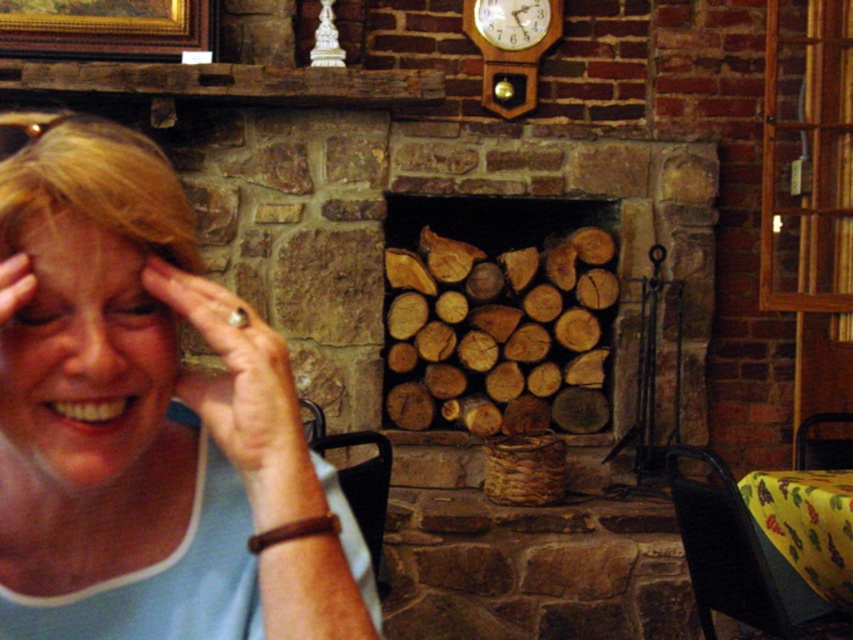
Question: Which object is closer to the camera taking this photo?

Choices:
 (A) yellow fabric tablecloth at lower right
 (B) wooden logs at center

Answer: (A)

Question: Does matte blue shirt at center have a lesser width compared to gold-framed painting at upper left?

Choices:
 (A) yes
 (B) no

Answer: (A)

Question: Which of the following is the farthest from the observer?

Choices:
 (A) (102, 224)
 (B) (585, 429)
 (C) (107, 420)
 (D) (129, 51)

Answer: (B)

Question: Which object appears closest to the camera in this image?

Choices:
 (A) matte blue shirt at center
 (B) gold-framed painting at upper left

Answer: (A)

Question: Is matte blue shirt at center bigger than matte skin hand at left?

Choices:
 (A) no
 (B) yes

Answer: (B)

Question: Observing the image, what is the correct spatial positioning of matte blue shirt at center in reference to smooth skin face at left?

Choices:
 (A) above
 (B) below

Answer: (B)